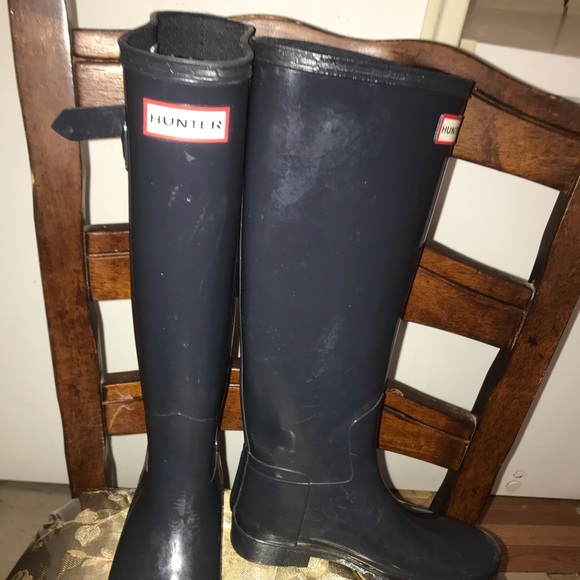
The image size is (580, 580). What are the coordinates of `vertical boards for backrest` in the screenshot? It's located at (57, 246), (551, 329).